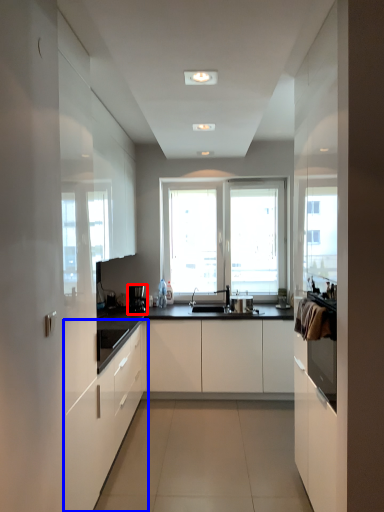
Question: Which object is further to the camera taking this photo, coffee machine (highlighted by a red box) or cabinetry (highlighted by a blue box)?

Choices:
 (A) coffee machine
 (B) cabinetry

Answer: (A)